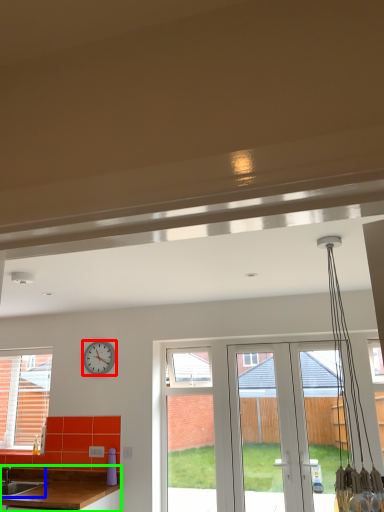
Question: Estimate the real-world distances between objects in this image. Which object is closer to clock (highlighted by a red box), sink (highlighted by a blue box) or countertop (highlighted by a green box)?

Choices:
 (A) sink
 (B) countertop

Answer: (B)